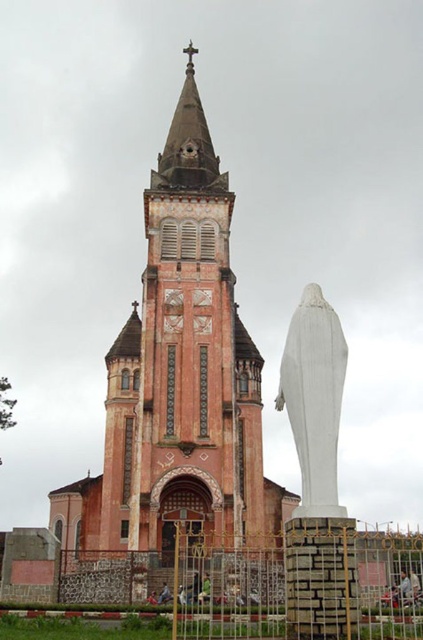
Which is below, pink stone tower at center or white marble statue at center?

Positioned lower is white marble statue at center.

Which is behind, point (247, 426) or point (337, 368)?

Point (247, 426)

The height and width of the screenshot is (640, 423). In order to click on pink stone tower at center in this screenshot , I will do `click(173, 396)`.

Locate an element on the screen. Image resolution: width=423 pixels, height=640 pixels. pink stone tower at center is located at coordinates (173, 396).